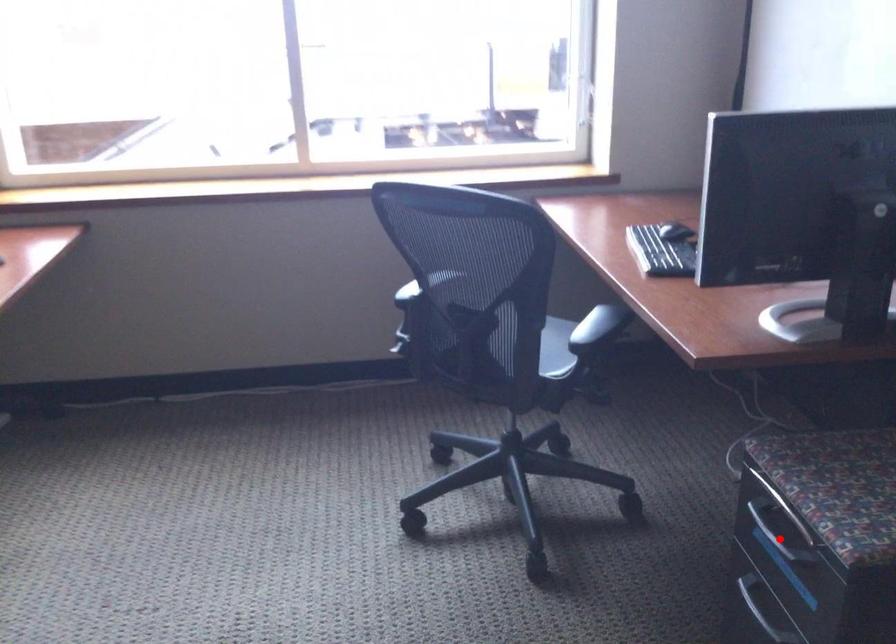
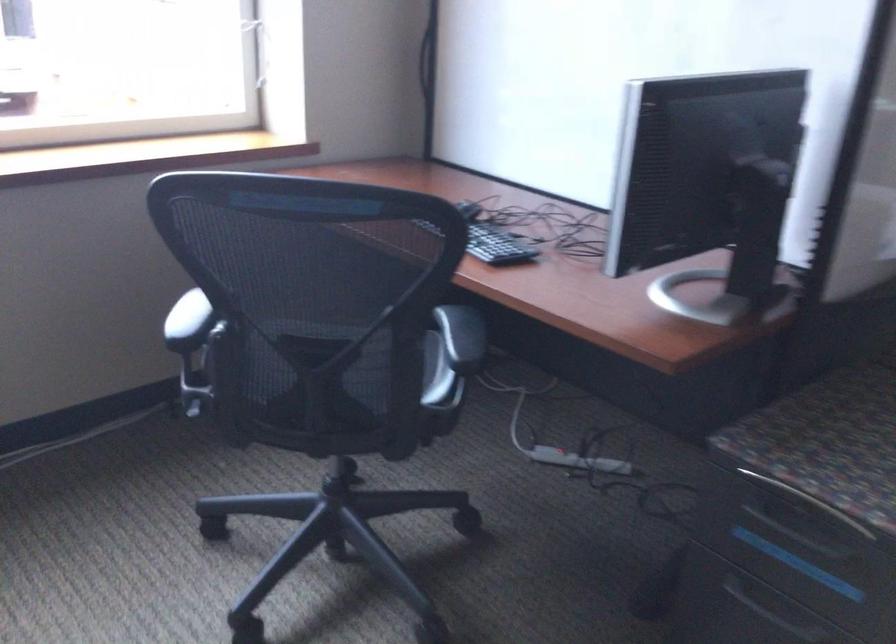
Find the pixel in the second image that matches the highlighted location in the first image.

(800, 536)